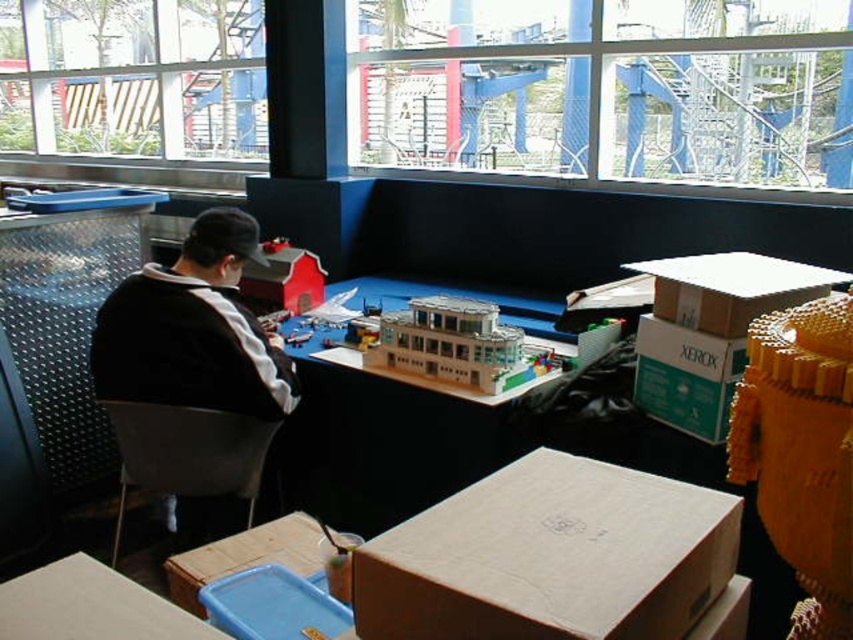
You are a visitor in this workspace and want to see the matte plastic barn at upper center clearly. Is the translucent plastic building at center blocking your view of it?

The translucent plastic building at center is in front of the matte plastic barn at upper center, so it is blocking the view of the matte plastic barn at upper center.

Based on the photo, you are an interior designer assessing the lighting in the workspace. You notice the transparent glass window at upper center and the black fabric jacket at left. Which object allows more natural light to pass through?

The transparent glass window at upper center allows more natural light to pass through because it is larger in size than the black fabric jacket at left.

You are organizing the workspace and need to move the brown cardboard box at center and the white cardboard box at upper right. If you want to move the box that is closer to you first, which box should you move first?

The brown cardboard box at center is closer to you than the white cardboard box at upper right, so you should move the brown cardboard box at center first.